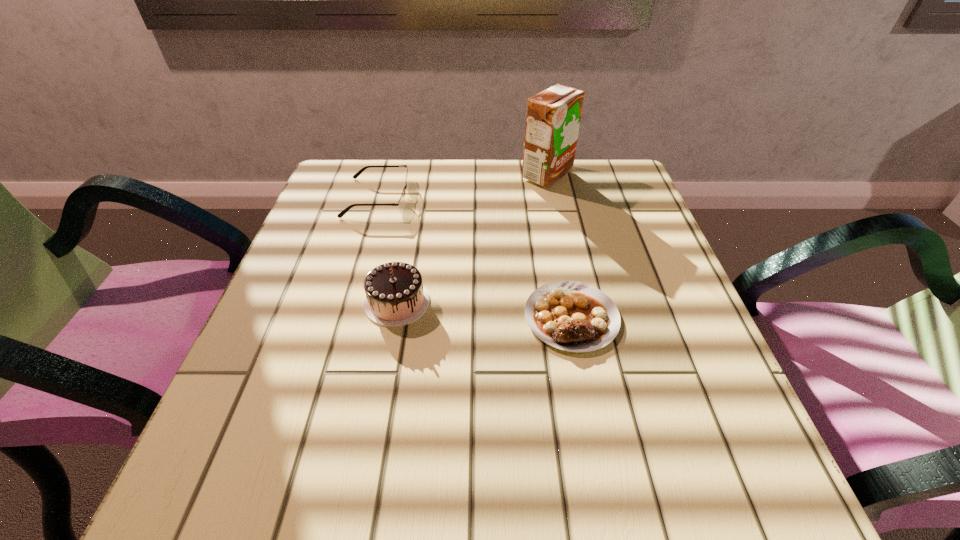
The width and height of the screenshot is (960, 540). I want to click on carton, so click(x=553, y=116).

Image resolution: width=960 pixels, height=540 pixels. What are the coordinates of `chocolate cake` in the screenshot? It's located at (395, 296).

I want to click on the second shortest object, so click(x=401, y=203).

I want to click on the shortest object, so [572, 316].

The image size is (960, 540). I want to click on blank space located 0.220m on the straw side of the tallest object, so [434, 175].

Locate an element on the screen. This screenshot has height=540, width=960. vacant space located 0.270m on the straw side of the tallest object is located at coordinates (414, 175).

At what (x,y) coordinates should I click in order to perform the action: click on vacant space located 0.180m on the straw side of the tallest object. Please return your answer as a coordinate pair (x, y). The image size is (960, 540). Looking at the image, I should click on (449, 175).

Image resolution: width=960 pixels, height=540 pixels. I want to click on vacant space situated 0.110m on the left of the second tallest object, so click(304, 302).

Where is `vacant space positioned 0.400m on the front-facing side of the spectacles`? The image size is (960, 540). vacant space positioned 0.400m on the front-facing side of the spectacles is located at coordinates (578, 198).

In order to click on vacant space positioned on the back of the steak in this screenshot , I will do click(551, 215).